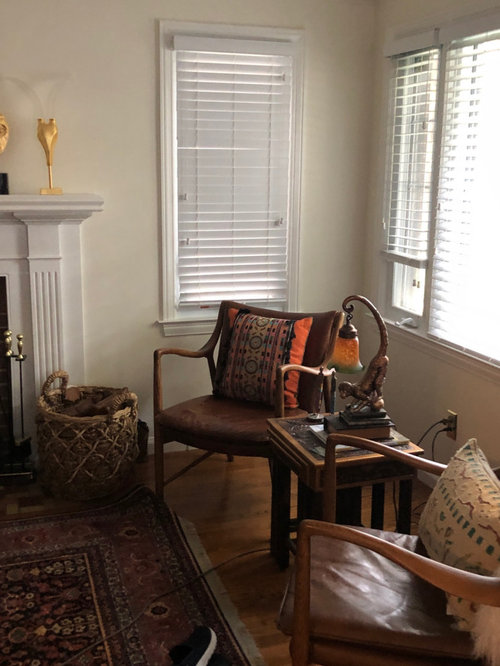
Where is `windows`? This screenshot has height=666, width=500. windows is located at coordinates (452, 304), (412, 274), (177, 234).